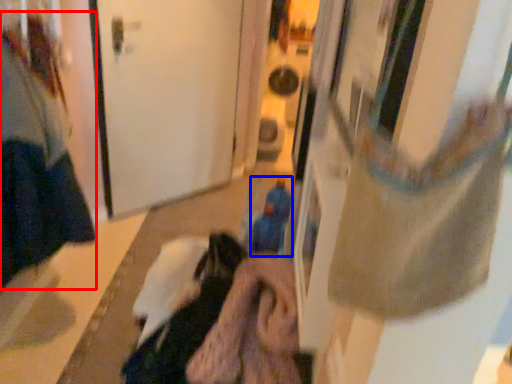
Question: Which point is closer to the camera, woman (highlighted by a red box) or toy (highlighted by a blue box)?

Choices:
 (A) woman
 (B) toy

Answer: (A)